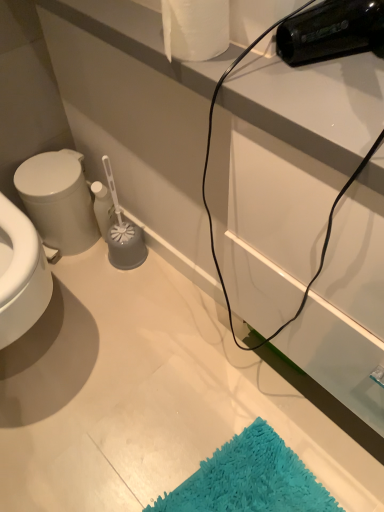
At what (x,y) coordinates should I click in order to perform the action: click on free location to the right of white matte toilet paper at upper center. Please return your answer as a coordinate pair (x, y). This screenshot has height=512, width=384. Looking at the image, I should click on (294, 65).